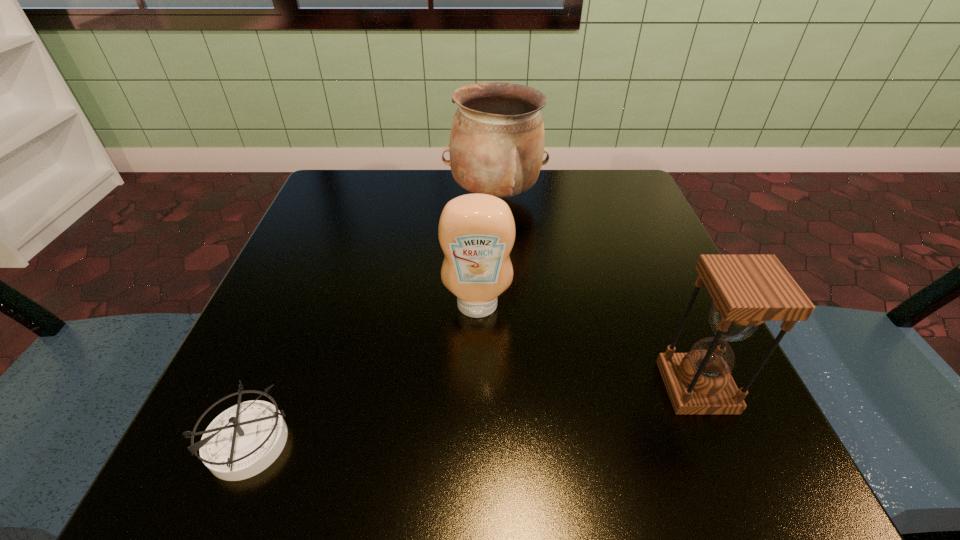
Where is `urn`? The height and width of the screenshot is (540, 960). urn is located at coordinates [497, 138].

The height and width of the screenshot is (540, 960). Identify the location of the second farthest object. (476, 232).

I want to click on the rightmost object, so click(x=747, y=290).

At what (x,y) coordinates should I click in order to perform the action: click on compass. Please return your answer as a coordinate pair (x, y). The height and width of the screenshot is (540, 960). Looking at the image, I should click on (245, 439).

The width and height of the screenshot is (960, 540). I want to click on the shortest object, so click(x=245, y=439).

Locate an element on the screen. This screenshot has height=540, width=960. vacant space located on the left of the urn is located at coordinates (419, 198).

Identify the location of vacant space located on the label of the condiment. (476, 458).

Locate an element on the screen. The height and width of the screenshot is (540, 960). free space located on the left of the rightmost object is located at coordinates (382, 387).

Find the location of a particular element. vacant space situated 0.110m on the back of the compass is located at coordinates (290, 340).

Locate an element on the screen. Image resolution: width=960 pixels, height=540 pixels. object located in the far edge section of the desktop is located at coordinates (497, 138).